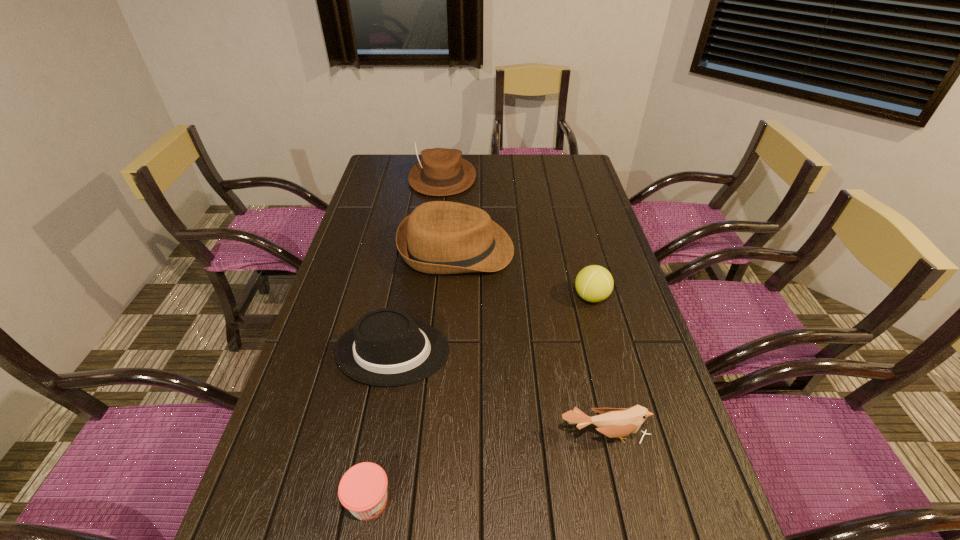
The image size is (960, 540). In the image, there is a desktop. Find the location of `vacant space at the left edge`. vacant space at the left edge is located at coordinates (330, 367).

Find the location of `vacant space at the right edge`. vacant space at the right edge is located at coordinates (564, 207).

I want to click on vacant region at the far right corner of the desktop, so click(564, 166).

Where is `free space between the fourth nearest object and the nearest object`? free space between the fourth nearest object and the nearest object is located at coordinates (480, 399).

This screenshot has width=960, height=540. Identify the location of vacant point located between the second tallest fedora and the fourth farthest object. (425, 300).

The height and width of the screenshot is (540, 960). In order to click on free space between the bird and the nearest fedora in this screenshot , I will do `click(498, 393)`.

The image size is (960, 540). Identify the location of free space between the jam and the bird. (487, 468).

I want to click on free point between the shortest object and the bird, so click(487, 468).

Locate an element on the screen. vacant space that is in between the shortest fedora and the shortest object is located at coordinates (381, 426).

This screenshot has height=540, width=960. What are the coordinates of `unoccupied position between the third farthest object and the nearest fedora` in the screenshot? It's located at (492, 324).